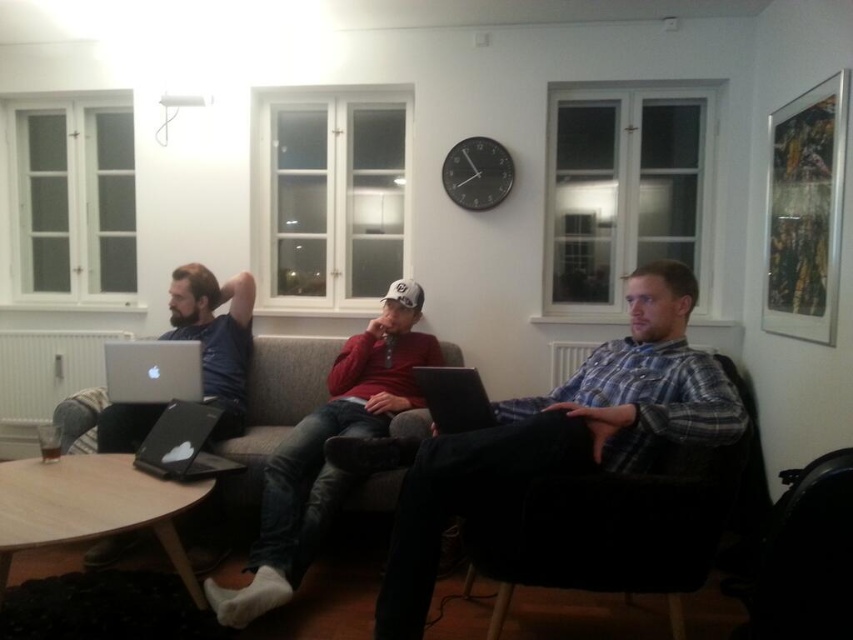
Based on the photo, is gray fabric couch at center bigger than matte black laptop at left?

Yes, gray fabric couch at center is bigger than matte black laptop at left.

Locate an element on the screen. gray fabric couch at center is located at coordinates (262, 432).

Locate an element on the screen. The height and width of the screenshot is (640, 853). gray fabric couch at center is located at coordinates [x=262, y=432].

Based on the photo, measure the distance between plaid fabric shirt at center and camera.

They are 1.81 meters apart.

Who is shorter, plaid fabric shirt at center or black matte laptop at center?

Standing shorter between the two is black matte laptop at center.

Is point (509, 468) closer to viewer compared to point (447, 372)?

That is True.

Find the location of `plaid fabric shirt at center`. plaid fabric shirt at center is located at coordinates pyautogui.click(x=553, y=435).

Is matte black laptop at left smaller than silver metallic laptop at left?

No.

What do you see at coordinates (215, 337) in the screenshot? I see `matte black laptop at left` at bounding box center [215, 337].

You are a GUI agent. You are given a task and a screenshot of the screen. Output one action in this format:
    pyautogui.click(x=<x>, y=<y>)
    Task: Click on the matte black laptop at left
    The image size is (853, 640).
    Given the screenshot: What is the action you would take?
    pyautogui.click(x=215, y=337)